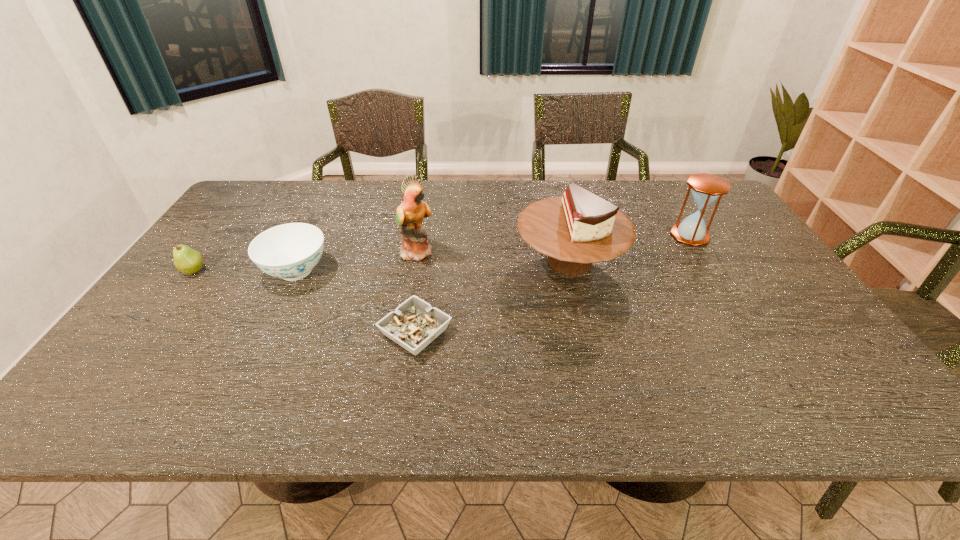
Locate an element on the screen. free space located 0.250m on the back of the second object from left to right is located at coordinates point(328,205).

Locate an element on the screen. This screenshot has width=960, height=540. vacant space located on the front of the leftmost object is located at coordinates (98, 397).

Where is `vacant position located on the back of the nearest object`? The height and width of the screenshot is (540, 960). vacant position located on the back of the nearest object is located at coordinates (426, 260).

Find the location of a particular element. object at the left edge is located at coordinates (188, 261).

The width and height of the screenshot is (960, 540). What are the coordinates of `object present at the right edge` in the screenshot? It's located at (706, 188).

At what (x,y) coordinates should I click in order to perform the action: click on free space at the far edge. Please return your answer as a coordinate pair (x, y). The width and height of the screenshot is (960, 540). Looking at the image, I should click on (449, 205).

Identify the location of free point at the left edge. 245,235.

The width and height of the screenshot is (960, 540). In the image, there is a desktop. Find the location of `vacant space at the right edge`. vacant space at the right edge is located at coordinates (797, 330).

This screenshot has height=540, width=960. I want to click on vacant position at the far left corner of the desktop, so click(268, 183).

This screenshot has height=540, width=960. What are the coordinates of `vacant region at the far right corner` in the screenshot? It's located at (671, 193).